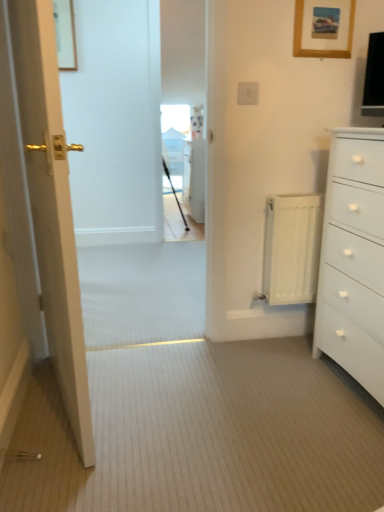
Question: Is the position of white plastic electric outlet at upper center more distant than that of wooden picture frame at upper left, arranged as the 1th picture frame when viewed from the top?

Choices:
 (A) no
 (B) yes

Answer: (A)

Question: From the image's perspective, would you say white plastic electric outlet at upper center is shown under wooden picture frame at upper left, acting as the first picture frame starting from the back?

Choices:
 (A) yes
 (B) no

Answer: (A)

Question: Could wooden picture frame at upper left, acting as the first picture frame starting from the back, be considered to be inside white plastic electric outlet at upper center?

Choices:
 (A) no
 (B) yes

Answer: (A)

Question: Can you confirm if white plastic electric outlet at upper center is taller than wooden picture frame at upper left, positioned as the 2th picture frame in front-to-back order?

Choices:
 (A) yes
 (B) no

Answer: (B)

Question: Is white plastic electric outlet at upper center wider than wooden picture frame at upper left, the second picture frame in the bottom-to-top sequence?

Choices:
 (A) yes
 (B) no

Answer: (B)

Question: Is white matte chest of drawers at right wider or thinner than matte gold door at left?

Choices:
 (A) thin
 (B) wide

Answer: (B)

Question: Relative to matte gold door at left, is white matte chest of drawers at right in front or behind?

Choices:
 (A) front
 (B) behind

Answer: (B)

Question: From the image's perspective, is white matte chest of drawers at right positioned above or below matte gold door at left?

Choices:
 (A) below
 (B) above

Answer: (A)

Question: In terms of height, does white matte chest of drawers at right look taller or shorter compared to matte gold door at left?

Choices:
 (A) short
 (B) tall

Answer: (A)

Question: Choose the correct answer: Is white plastic electric outlet at upper center inside white metallic radiator at right or outside it?

Choices:
 (A) outside
 (B) inside

Answer: (A)

Question: In terms of width, does white plastic electric outlet at upper center look wider or thinner when compared to white metallic radiator at right?

Choices:
 (A) thin
 (B) wide

Answer: (A)

Question: In terms of size, does white plastic electric outlet at upper center appear bigger or smaller than white metallic radiator at right?

Choices:
 (A) big
 (B) small

Answer: (B)

Question: Considering their positions, is white plastic electric outlet at upper center located in front of or behind white metallic radiator at right?

Choices:
 (A) front
 (B) behind

Answer: (A)

Question: Considering their positions, is white matte chest of drawers at right located in front of or behind white plastic electric outlet at upper center?

Choices:
 (A) front
 (B) behind

Answer: (A)

Question: Is point (347, 159) positioned closer to the camera than point (244, 99)?

Choices:
 (A) farther
 (B) closer

Answer: (B)